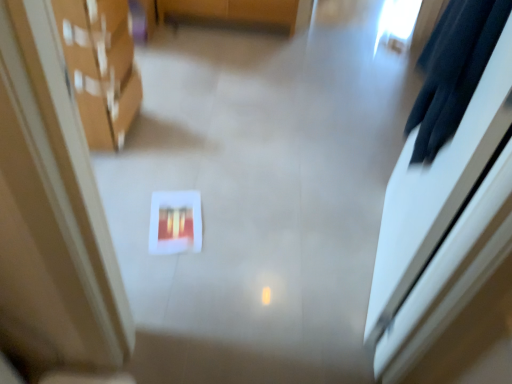
What are the coordinates of `vacant space in black fabric robe at upper right (from a real-world perspective)` in the screenshot? It's located at (362, 267).